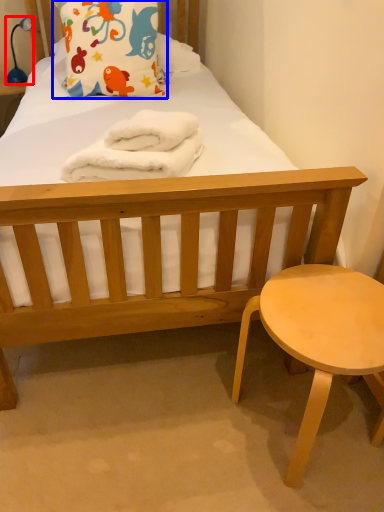
Question: Among these objects, which one is farthest to the camera, lamp (highlighted by a red box) or pillow (highlighted by a blue box)?

Choices:
 (A) lamp
 (B) pillow

Answer: (A)